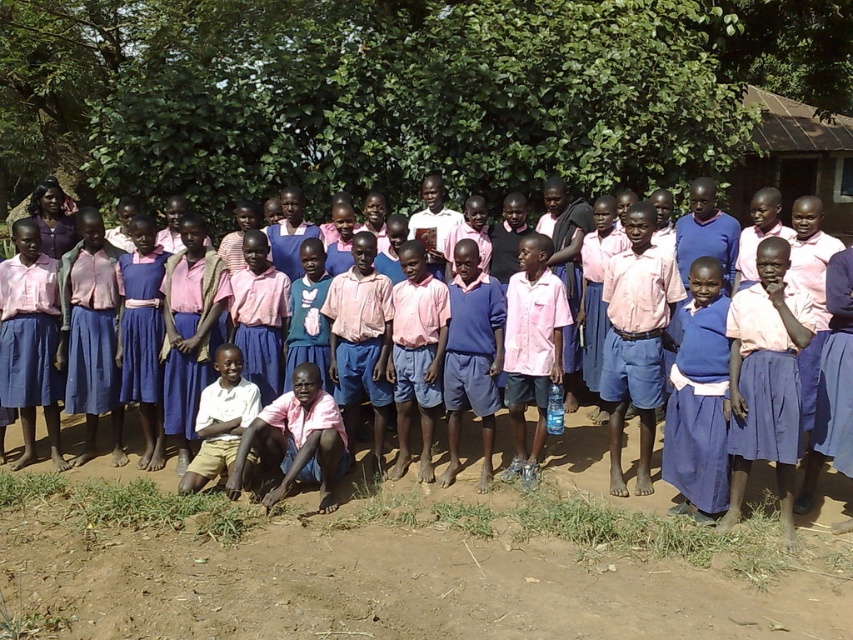
Is point (445, 541) positioned behind point (672, 394)?

No.

Who is lower down, brown soil at lower center or pink fabric shirt at center?

brown soil at lower center is lower down.

Find the location of a particular element. This screenshot has width=853, height=640. brown soil at lower center is located at coordinates (409, 561).

This screenshot has height=640, width=853. I want to click on brown soil at lower center, so click(x=409, y=561).